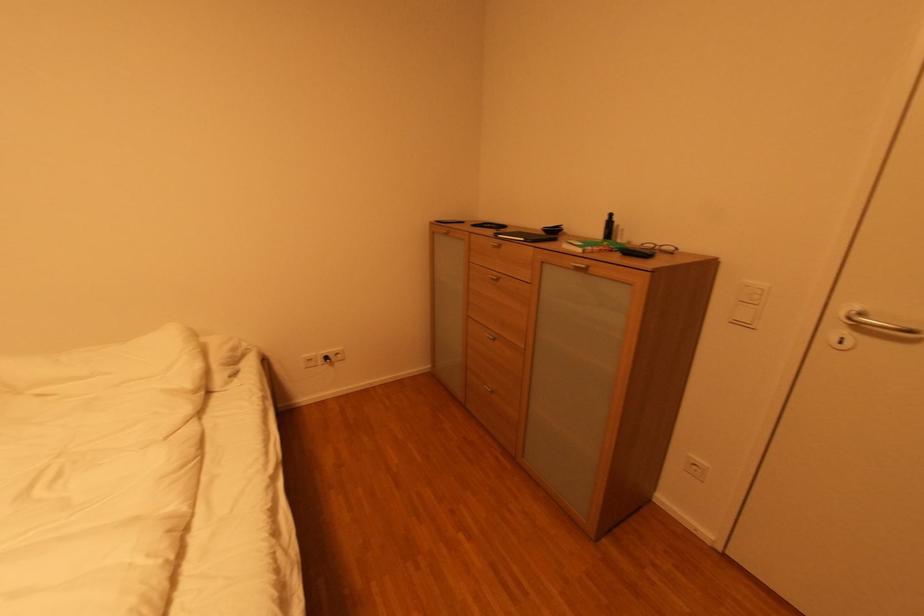
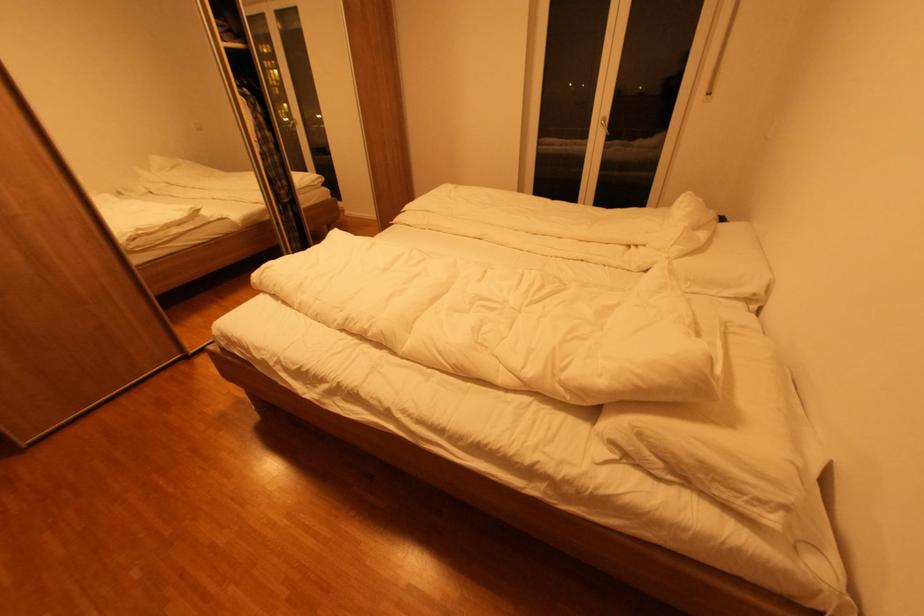
The point at (246, 355) is marked in the first image. Where is the corresponding point in the second image?

(723, 495)